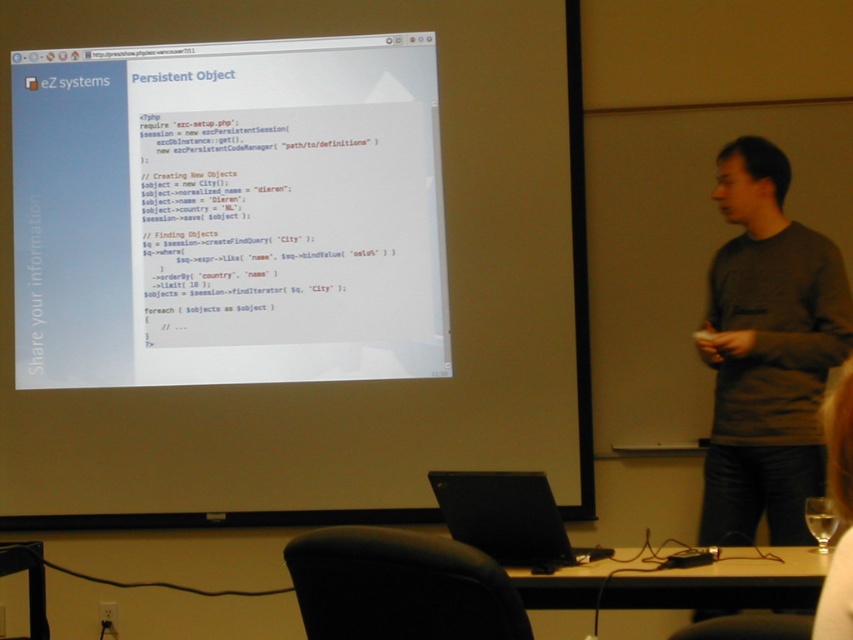
You are organizing a presentation and need to place a name tag on the desk. The name tag is the same width as the black matte laptop at center. Can you place it to the right of the white paper at upper center without overlapping?

The white paper at upper center is wider than the black matte laptop at center. Since the name tag has the same width as the black matte laptop at center, placing it to the right of the white paper at upper center would require space equal to or greater than the name tag width. However, since the white paper is wider, there might not be enough space unless the desk is sufficiently large. But based on the given information, we cannot determine the desk size. Therefore, it might not fit if the white paper is

You are an attendee at the presentation and need to reach the laptop to adjust something. The presenter is standing near the white fabric shirt at lower right. Can you walk around the desk to the black matte laptop at center without passing in front of the presenter?

The black matte laptop at center is to the left of the white fabric shirt at lower right. Since the presenter is near the white fabric shirt at lower right, walking around the desk to the left side would allow you to reach the black matte laptop at center without passing in front of them.

You are attending a presentation and want to take a photo of the slide titled Persistent. The slide is displayed on the projection screen. The camera you have can only focus on objects within 4 meters. Is the point on the slide at coordinates point (158, 140) within the camera focus range?

The point (158, 140) is 3.95 meters from the camera, which is within the 4 meters focus range. Therefore, the camera can focus on that point.